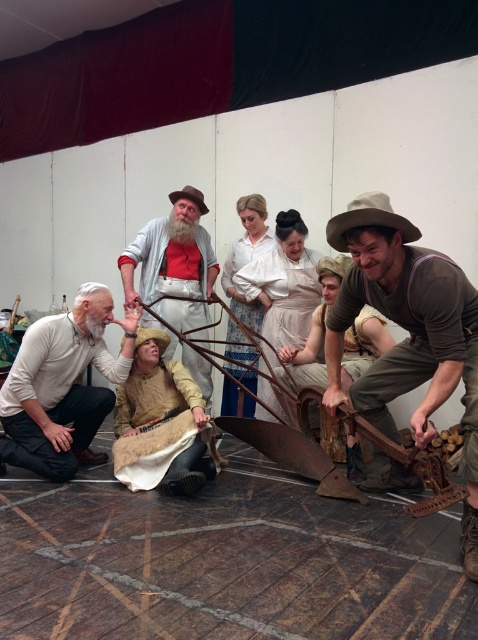
A stage director is planning to place a new spotlight at position 0.5, 0.8 on the stage. They want to ensure it doesn not shine directly on any of the objects in the scene. Is the brown canvas hat at center in the way of this spotlight?

The brown canvas hat at center is located at point (410,333), which is close to but not exactly at (382,320). Depending on the spotlight beam width, it might partially overlap, but the exact answer requires knowing the spotlight beam spread.

You are a stagehand preparing for a scene change. You need to move a prop from the white matte shirt at lower left to the white cotton blouse at center. Which direction should you move the prop?

The white matte shirt at lower left is to the left of the white cotton blouse at center, so you should move the prop to the right.